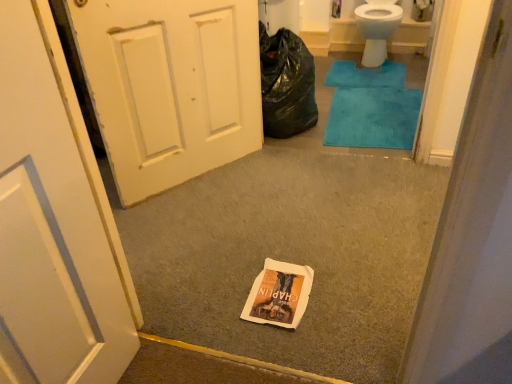
I want to click on vacant area to the left of white paper bag at center, so click(x=219, y=294).